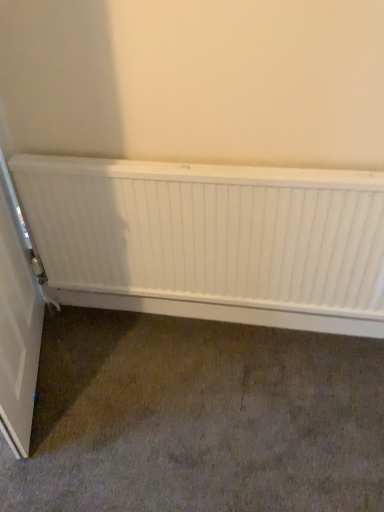
Question: Is white matte radiator at center wider or thinner than white matte door at left?

Choices:
 (A) wide
 (B) thin

Answer: (B)

Question: Considering their positions, is white matte radiator at center located in front of or behind white matte door at left?

Choices:
 (A) front
 (B) behind

Answer: (B)

Question: Is point (145, 229) closer or farther from the camera than point (41, 329)?

Choices:
 (A) farther
 (B) closer

Answer: (B)

Question: Based on their positions, is white matte door at left located to the left or right of white matte radiator at center?

Choices:
 (A) right
 (B) left

Answer: (B)

Question: Do you think white matte door at left is within white matte radiator at center, or outside of it?

Choices:
 (A) outside
 (B) inside

Answer: (A)

Question: Looking at their shapes, would you say white matte door at left is wider or thinner than white matte radiator at center?

Choices:
 (A) wide
 (B) thin

Answer: (A)

Question: Is white matte door at left taller or shorter than white matte radiator at center?

Choices:
 (A) tall
 (B) short

Answer: (A)